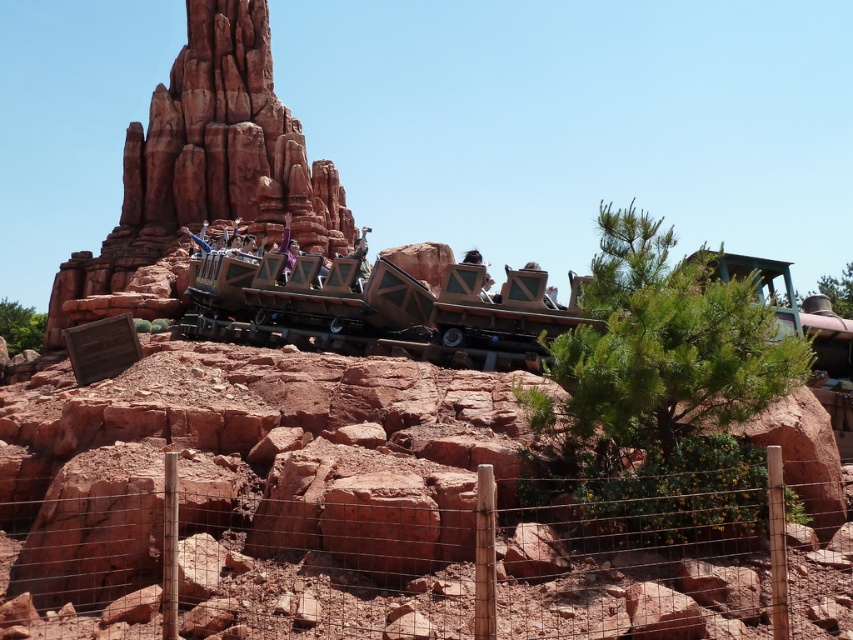
You are standing at the point marked as point (834,628). You want to walk to the roller coaster train that is tilted sharply to the. Can you reach it without crossing the wire fence that runs along the bottom edge?

The distance between you at point (834,628) and the roller coaster train is 38.94 meters. Since the wire fence is along the bottom edge, you can walk around it to reach the roller coaster train within 38.94 meters.